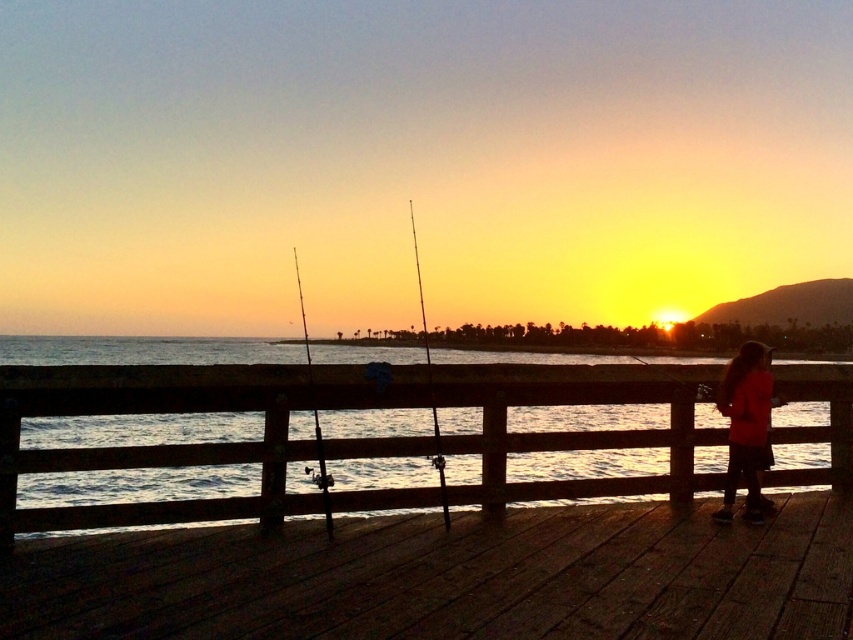
Question: Which object is positioned closest to the silky red dress at lower right?

Choices:
 (A) wooden water at center
 (B) metallic fishing pole at center
 (C) silhouette rod at center
 (D) dark wood dock at lower center

Answer: (A)

Question: Is silky red dress at lower right bigger than silhouette rod at center?

Choices:
 (A) yes
 (B) no

Answer: (B)

Question: Is dark wood dock at lower center positioned in front of wooden water at center?

Choices:
 (A) yes
 (B) no

Answer: (A)

Question: Which point appears farthest from the camera in this image?

Choices:
 (A) (752, 586)
 (B) (302, 300)

Answer: (B)

Question: Among these points, which one is nearest to the camera?

Choices:
 (A) (734, 464)
 (B) (608, 637)

Answer: (B)

Question: Can you confirm if dark wood dock at lower center is thinner than silhouette rod at center?

Choices:
 (A) no
 (B) yes

Answer: (B)